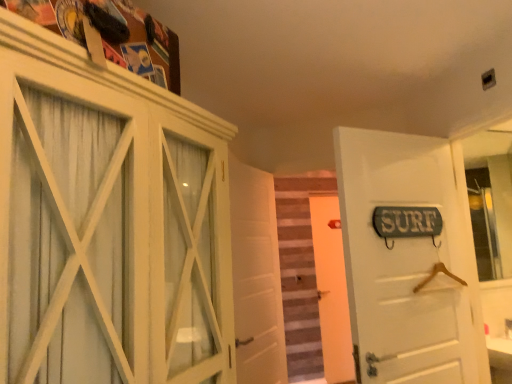
The height and width of the screenshot is (384, 512). What do you see at coordinates (332, 290) in the screenshot?
I see `white wooden door at center, arranged as the third door when viewed from the front` at bounding box center [332, 290].

The image size is (512, 384). Describe the element at coordinates (490, 201) in the screenshot. I see `clear glass mirror at right` at that location.

What do you see at coordinates (256, 276) in the screenshot?
I see `white matte door at center, the 2th door when ordered from front to back` at bounding box center [256, 276].

What are the coordinates of `wooden stairs at center` in the screenshot? It's located at (300, 274).

The image size is (512, 384). What do you see at coordinates (409, 259) in the screenshot? I see `white matte door at right, acting as the first door starting from the front` at bounding box center [409, 259].

Locate an element on the screen. The width and height of the screenshot is (512, 384). green painted wood surf sign at upper right is located at coordinates (407, 223).

You are a GUI agent. You are given a task and a screenshot of the screen. Output one action in this format:
    pyautogui.click(x=<x>, y=<y>)
    Task: Click on the white wooden door at center, arranged as the third door when viewed from the front
    The width and height of the screenshot is (512, 384).
    Given the screenshot: What is the action you would take?
    pyautogui.click(x=332, y=290)

From a real-world perspective, which is physically below, clear glass mirror at right or white matte door at right, acting as the first door starting from the front?

From a 3D spatial view, white matte door at right, acting as the first door starting from the front, is below.

This screenshot has height=384, width=512. Find the location of `mirror located behind the white matte door at right, acting as the first door starting from the front`. mirror located behind the white matte door at right, acting as the first door starting from the front is located at coordinates (490, 201).

Does clear glass mirror at right come behind white matte door at right, acting as the first door starting from the front?

Yes, it is.

From the image's perspective, between white matte door at center, the 2th door when ordered from front to back, and clear glass mirror at right, who is located below?

white matte door at center, the 2th door when ordered from front to back, appears lower in the image.

Is white matte door at center, the second door viewed from the back, in front of or behind clear glass mirror at right in the image?

Clearly, white matte door at center, the second door viewed from the back, is in front of clear glass mirror at right.

Is white matte door at center, the 2th door when ordered from front to back, to the left or to the right of clear glass mirror at right in the image?

Clearly, white matte door at center, the 2th door when ordered from front to back, is on the left of clear glass mirror at right in the image.

How many degrees apart are the facing directions of white matte door at center, the 2th door when ordered from front to back, and clear glass mirror at right?

There is a 43.6-degree angle between the facing directions of white matte door at center, the 2th door when ordered from front to back, and clear glass mirror at right.

Is clear glass mirror at right turned away from white matte door at center, the second door viewed from the back?

No, white matte door at center, the second door viewed from the back, is not at the back of clear glass mirror at right.

Which of these two, clear glass mirror at right or white matte door at center, the second door viewed from the back, stands shorter?

With less height is clear glass mirror at right.

In the image, is clear glass mirror at right positioned in front of or behind white matte door at center, the 2th door when ordered from front to back?

clear glass mirror at right is positioned farther from the viewer than white matte door at center, the 2th door when ordered from front to back.

Between point (468, 148) and point (262, 351), which one is positioned behind?

Positioned behind is point (468, 148).

Can you confirm if white matte door at right, positioned as the third door in back-to-front order, is positioned to the right of white wood cabinet at upper left?

Yes.

Considering the sizes of objects white matte door at right, positioned as the third door in back-to-front order, and white wood cabinet at upper left in the image provided, who is shorter, white matte door at right, positioned as the third door in back-to-front order, or white wood cabinet at upper left?

white wood cabinet at upper left.

Consider the image. Considering the sizes of white matte door at right, positioned as the third door in back-to-front order, and white wood cabinet at upper left in the image, is white matte door at right, positioned as the third door in back-to-front order, wider or thinner than white wood cabinet at upper left?

Clearly, white matte door at right, positioned as the third door in back-to-front order, has less width compared to white wood cabinet at upper left.

Can you confirm if white wood cabinet at upper left is positioned to the right of white matte door at center, the second door viewed from the back?

In fact, white wood cabinet at upper left is to the left of white matte door at center, the second door viewed from the back.

Relative to white matte door at center, the second door viewed from the back, is white wood cabinet at upper left in front or behind?

In the image, white wood cabinet at upper left appears in front of white matte door at center, the second door viewed from the back.

Is point (133, 95) closer to camera compared to point (267, 207)?

Yes, point (133, 95) is closer to viewer.

Consider the image. Are white wood cabinet at upper left and white matte door at center, the second door viewed from the back, making contact?

No, white wood cabinet at upper left is not touching white matte door at center, the second door viewed from the back.

Considering the relative sizes of white matte door at right, acting as the first door starting from the front, and white matte door at center, the second door viewed from the back, in the image provided, is white matte door at right, acting as the first door starting from the front, taller than white matte door at center, the second door viewed from the back,?

No.

From a real-world perspective, relative to white matte door at center, the 2th door when ordered from front to back, is white matte door at right, acting as the first door starting from the front, vertically above or below?

white matte door at right, acting as the first door starting from the front, is situated higher than white matte door at center, the 2th door when ordered from front to back, in the real world.

In the scene shown: From the image's perspective, is white matte door at right, acting as the first door starting from the front, on white matte door at center, the second door viewed from the back?

Yes, from the image's perspective, white matte door at right, acting as the first door starting from the front, is on top of white matte door at center, the second door viewed from the back.

From a real-world perspective, is green painted wood surf sign at upper right on top of white wood cabinet at upper left?

Correct, in the physical world, green painted wood surf sign at upper right is higher than white wood cabinet at upper left.

Based on the photo, considering the relative positions of green painted wood surf sign at upper right and white wood cabinet at upper left in the image provided, is green painted wood surf sign at upper right behind white wood cabinet at upper left?

Yes, the depth of green painted wood surf sign at upper right is greater than that of white wood cabinet at upper left.

Starting from the clear glass mirror at right, which door is the 2nd one to the left? Please provide its 2D coordinates.

[(409, 259)]

Find the location of a particular element. The height and width of the screenshot is (384, 512). mirror above the white matte door at center, the 2th door when ordered from front to back (from a real-world perspective) is located at coordinates (490, 201).

From the image, which object appears to be farther from green painted wood surf sign at upper right, white wood cabinet at upper left or white wooden door at center, arranged as the third door when viewed from the front?

white wooden door at center, arranged as the third door when viewed from the front, is further to green painted wood surf sign at upper right.

From the image, which object appears to be nearer to white matte door at right, positioned as the third door in back-to-front order, clear glass mirror at right or white matte door at center, the 2th door when ordered from front to back?

white matte door at center, the 2th door when ordered from front to back.

Considering their positions, is white wood cabinet at upper left positioned further to white wooden door at center, which is the 1th door in back-to-front order, than clear glass mirror at right?

Among the two, white wood cabinet at upper left is located further to white wooden door at center, which is the 1th door in back-to-front order.

When comparing their distances from green painted wood surf sign at upper right, does wooden stairs at center or white matte door at center, the second door viewed from the back, seem further?

Among the two, wooden stairs at center is located further to green painted wood surf sign at upper right.

Based on their spatial positions, is wooden stairs at center or green painted wood surf sign at upper right closer to white wood cabinet at upper left?

The object closer to white wood cabinet at upper left is green painted wood surf sign at upper right.

Looking at the image, which one is located further to white matte door at center, the 2th door when ordered from front to back, green painted wood surf sign at upper right or white wood cabinet at upper left?

Among the two, white wood cabinet at upper left is located further to white matte door at center, the 2th door when ordered from front to back.

Considering their positions, is wooden stairs at center positioned further to clear glass mirror at right than white wooden door at center, which is the 1th door in back-to-front order?

Based on the image, wooden stairs at center appears to be further to clear glass mirror at right.

Based on their spatial positions, is white wooden door at center, arranged as the third door when viewed from the front, or white matte door at center, the second door viewed from the back, closer to clear glass mirror at right?

white wooden door at center, arranged as the third door when viewed from the front, is closer to clear glass mirror at right.

At what (x,y) coordinates should I click in order to perform the action: click on door between white matte door at right, acting as the first door starting from the front, and wooden stairs at center, along the z-axis. Please return your answer as a coordinate pair (x, y). This screenshot has width=512, height=384. Looking at the image, I should click on (256, 276).

Where is `street sign between white matte door at right, positioned as the third door in back-to-front order, and clear glass mirror at right in the front-back direction`? This screenshot has height=384, width=512. street sign between white matte door at right, positioned as the third door in back-to-front order, and clear glass mirror at right in the front-back direction is located at coordinates tap(407, 223).

Where is `mirror between white matte door at right, acting as the first door starting from the front, and white wooden door at center, arranged as the third door when viewed from the front, from front to back`? mirror between white matte door at right, acting as the first door starting from the front, and white wooden door at center, arranged as the third door when viewed from the front, from front to back is located at coordinates (490, 201).

Where is `street sign between white wood cabinet at upper left and white matte door at center, the second door viewed from the back, in the front-back direction`? The height and width of the screenshot is (384, 512). street sign between white wood cabinet at upper left and white matte door at center, the second door viewed from the back, in the front-back direction is located at coordinates coord(407,223).